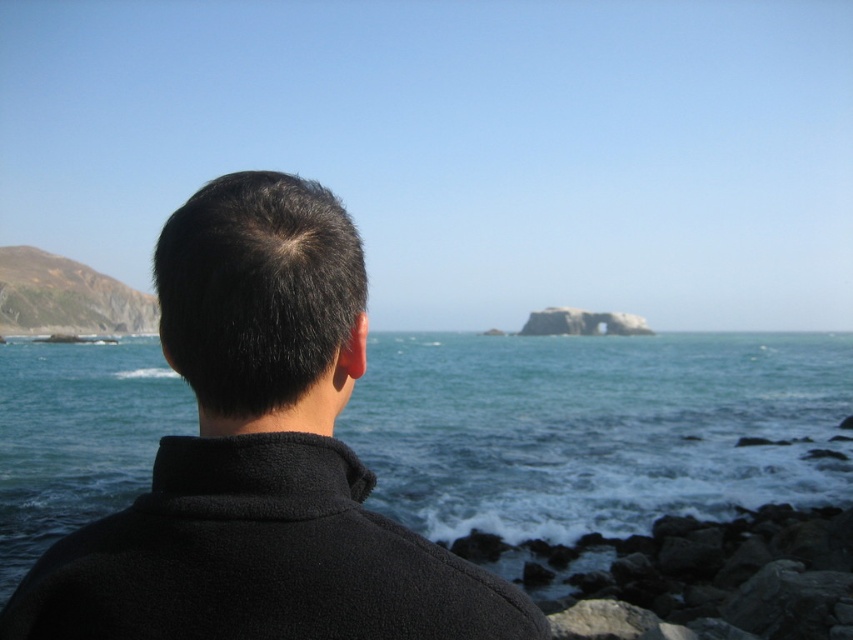
Question: Is gray rock at lower right to the right of green mossy cliff at left from the viewer's perspective?

Choices:
 (A) yes
 (B) no

Answer: (A)

Question: Estimate the real-world distances between objects in this image. Which object is farther from the green mossy cliff at left?

Choices:
 (A) black fleece jacket at center
 (B) gray rock at lower right
 (C) blue water at center

Answer: (A)

Question: Which object is the closest to the black fleece jacket at center?

Choices:
 (A) gray rock at lower right
 (B) green mossy cliff at left
 (C) blue water at center

Answer: (A)

Question: Does blue water at center appear on the right side of black fleece jacket at center?

Choices:
 (A) yes
 (B) no

Answer: (B)

Question: Can you confirm if black fleece jacket at center is wider than gray rock at lower right?

Choices:
 (A) yes
 (B) no

Answer: (B)

Question: Which of these objects is positioned closest to the gray rock at lower right?

Choices:
 (A) blue water at center
 (B) black fleece jacket at center

Answer: (B)